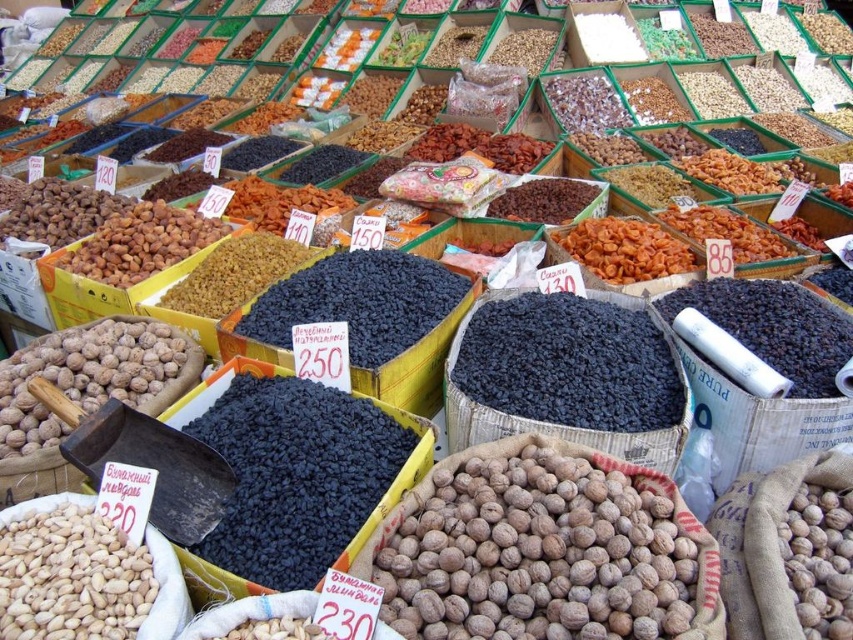
You are a customer at the market stall and want to buy the tallest walnut between the brown rough walnut at lower left and the brown rough walnut at lower right. Which one should you choose?

The brown rough walnut at lower left is much taller than the brown rough walnut at lower right, so you should choose the brown rough walnut at lower left.

You are a customer at the market stall and want to buy the item located at point (x=271, y=483). However, there is an obstacle at point (x=109, y=368). Can you reach the item without moving around the obstacle?

Point (x=271, y=483) is in front of point (x=109, y=368), so you can reach the item at point (x=271, y=483) without moving around the obstacle because it is closer to you than the obstacle.